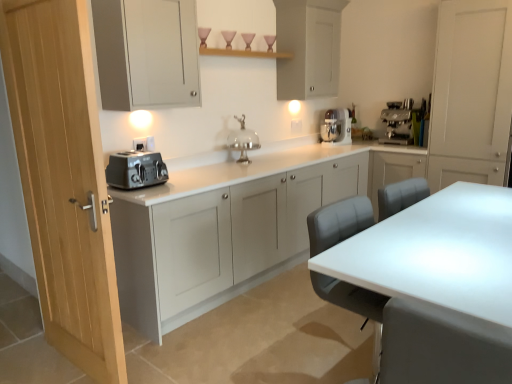
Image resolution: width=512 pixels, height=384 pixels. Find the location of `white glossy table at lower right`. white glossy table at lower right is located at coordinates (439, 285).

Describe the element at coordinates (243, 140) in the screenshot. I see `silver metallic cake stand at center` at that location.

Describe the element at coordinates (146, 53) in the screenshot. I see `matte gray cabinet at upper left, marked as the first cabinetry in a left-to-right arrangement` at that location.

Identify the location of satin silver toaster at left. (135, 170).

Describe the element at coordinates (471, 93) in the screenshot. I see `white matte cabinet at right, arranged as the fourth cabinetry when viewed from the left` at that location.

I want to click on matte white cabinet at upper center, which ranks as the second cabinetry in right-to-left order, so click(308, 47).

Who is shorter, matte white electric outlet at upper center or matte white cabinet at upper center, marked as the 3th cabinetry in a left-to-right arrangement?

Standing shorter between the two is matte white electric outlet at upper center.

Does point (139, 146) lie in front of point (315, 92)?

Yes, point (139, 146) is in front of point (315, 92).

Based on the photo, is matte white electric outlet at upper center completely or partially outside of matte white cabinet at upper center, marked as the 3th cabinetry in a left-to-right arrangement?

Yes, matte white electric outlet at upper center is located beyond the bounds of matte white cabinet at upper center, marked as the 3th cabinetry in a left-to-right arrangement.

There is a white glossy table at lower right. Where is `the 1st cabinetry above it (from a real-world perspective)`? This screenshot has height=384, width=512. the 1st cabinetry above it (from a real-world perspective) is located at coordinates (471, 93).

Is white glossy table at lower right positioned before white matte cabinet at right, arranged as the fourth cabinetry when viewed from the left?

That is True.

From the image's perspective, is white glossy table at lower right above or below white matte cabinet at right, arranged as the fourth cabinetry when viewed from the left?

From the image's perspective, white glossy table at lower right appears below white matte cabinet at right, arranged as the fourth cabinetry when viewed from the left.

Looking at this image, from a real-world perspective, relative to white matte cabinet at right, marked as the 1th cabinetry in a right-to-left arrangement, is white glossy table at lower right vertically above or below?

Clearly, from a real-world perspective, white glossy table at lower right is below white matte cabinet at right, marked as the 1th cabinetry in a right-to-left arrangement.

Is white matte cabinet at right, marked as the 1th cabinetry in a right-to-left arrangement, taller or shorter than light wood door at left?

Considering their sizes, white matte cabinet at right, marked as the 1th cabinetry in a right-to-left arrangement, has less height than light wood door at left.

Consider the image. Is white matte cabinet at right, marked as the 1th cabinetry in a right-to-left arrangement, oriented away from light wood door at left?

white matte cabinet at right, marked as the 1th cabinetry in a right-to-left arrangement, does not have its back to light wood door at left.

Which is in front, white matte cabinet at right, arranged as the fourth cabinetry when viewed from the left, or light wood door at left?

light wood door at left is more forward.

Considering the positions of point (396, 138) and point (156, 160), is point (396, 138) closer or farther from the camera than point (156, 160)?

Clearly, point (396, 138) is more distant from the camera than point (156, 160).

From the image's perspective, which one is positioned lower, satin silver coffee machine at upper right or satin silver toaster at left?

satin silver toaster at left.

Is satin silver coffee machine at upper right inside the boundaries of satin silver toaster at left, or outside?

satin silver coffee machine at upper right is outside satin silver toaster at left.

Would you consider satin silver coffee machine at upper right to be distant from satin silver toaster at left?

Indeed, satin silver coffee machine at upper right is not near satin silver toaster at left.

Can light wood door at left be found inside satin silver toaster at left?

No, light wood door at left is not inside satin silver toaster at left.

Which object is more forward, satin silver toaster at left or light wood door at left?

Positioned in front is light wood door at left.

Consider the image. Is satin silver toaster at left placed right next to light wood door at left?

They are not placed beside each other.

Is light wood door at left at the back of satin silver toaster at left?

satin silver toaster at left does not have its back to light wood door at left.

Considering the relative sizes of satin silver toaster at left and white glossy stand mixer at upper right in the image provided, is satin silver toaster at left taller than white glossy stand mixer at upper right?

In fact, satin silver toaster at left may be shorter than white glossy stand mixer at upper right.

You are a GUI agent. You are given a task and a screenshot of the screen. Output one action in this format:
    pyautogui.click(x=<x>, y=<y>)
    Task: Click on the kitchen appliance behind the satin silver toaster at left
    
    Given the screenshot: What is the action you would take?
    pyautogui.click(x=336, y=126)

Would you say satin silver toaster at left is to the left or to the right of white glossy stand mixer at upper right in the picture?

satin silver toaster at left is positioned on white glossy stand mixer at upper right's left side.

From the image's perspective, would you say satin silver toaster at left is positioned over white glossy stand mixer at upper right?

No, from the image's perspective, satin silver toaster at left is not over white glossy stand mixer at upper right.

From the image's perspective, between white glossy stand mixer at upper right and satin silver coffee machine at upper right, who is located below?

satin silver coffee machine at upper right appears lower in the image.

Based on the photo, in the image, is white glossy stand mixer at upper right positioned in front of or behind satin silver coffee machine at upper right?

white glossy stand mixer at upper right is behind satin silver coffee machine at upper right.

Looking at the image, does white glossy stand mixer at upper right seem bigger or smaller compared to satin silver coffee machine at upper right?

In the image, white glossy stand mixer at upper right appears to be smaller than satin silver coffee machine at upper right.

Is white glossy stand mixer at upper right positioned far away from satin silver coffee machine at upper right?

No.

The width and height of the screenshot is (512, 384). Find the location of `electric outlet on the left side of matte white cabinet at upper center, which ranks as the second cabinetry in right-to-left order`. electric outlet on the left side of matte white cabinet at upper center, which ranks as the second cabinetry in right-to-left order is located at coordinates (144, 144).

Locate an element on the screen. table below the white matte cabinet at right, marked as the 1th cabinetry in a right-to-left arrangement (from the image's perspective) is located at coordinates click(439, 285).

When comparing their distances from satin silver coffee machine at upper right, does white glossy table at lower right or matte gray cabinet at upper left, marked as the first cabinetry in a left-to-right arrangement, seem further?

white glossy table at lower right.

When comparing their distances from matte white electric outlet at upper center, does matte gray cabinet at left, which is the third cabinetry in right-to-left order, or light wood door at left seem closer?

light wood door at left is positioned closer to the anchor matte white electric outlet at upper center.

Based on their spatial positions, is light wood door at left or matte gray cabinet at upper left, marked as the first cabinetry in a left-to-right arrangement, further from silver metallic cake stand at center?

light wood door at left.

Based on their spatial positions, is satin silver coffee machine at upper right or white matte cabinet at right, arranged as the fourth cabinetry when viewed from the left, closer to matte gray cabinet at left, which is the third cabinetry in right-to-left order?

white matte cabinet at right, arranged as the fourth cabinetry when viewed from the left.

Considering their positions, is matte gray cabinet at left, which is the third cabinetry in right-to-left order, positioned closer to matte white cabinet at upper center, which ranks as the second cabinetry in right-to-left order, than matte gray cabinet at upper left, marked as the first cabinetry in a left-to-right arrangement?

The object closer to matte white cabinet at upper center, which ranks as the second cabinetry in right-to-left order, is matte gray cabinet at left, which is the third cabinetry in right-to-left order.

Which object lies nearer to the anchor point satin silver toaster at left, silver metallic cake stand at center or matte white electric outlet at upper center?

The object closer to satin silver toaster at left is matte white electric outlet at upper center.

Considering their positions, is silver metallic cake stand at center positioned closer to satin silver toaster at left than light wood door at left?

Among the two, light wood door at left is located nearer to satin silver toaster at left.

Estimate the real-world distances between objects in this image. Which object is further from matte white cabinet at upper center, marked as the 3th cabinetry in a left-to-right arrangement, satin silver coffee machine at upper right or matte white electric outlet at upper center?

matte white electric outlet at upper center is positioned further to the anchor matte white cabinet at upper center, marked as the 3th cabinetry in a left-to-right arrangement.

Where is `coffee machine situated between silver metallic cake stand at center and white matte cabinet at right, arranged as the fourth cabinetry when viewed from the left, from left to right`? This screenshot has height=384, width=512. coffee machine situated between silver metallic cake stand at center and white matte cabinet at right, arranged as the fourth cabinetry when viewed from the left, from left to right is located at coordinates (398, 122).

Where is `door located between white glossy table at lower right and satin silver coffee machine at upper right in the depth direction`? The width and height of the screenshot is (512, 384). door located between white glossy table at lower right and satin silver coffee machine at upper right in the depth direction is located at coordinates (63, 181).

At what (x,y) coordinates should I click in order to perform the action: click on faucet between white glossy table at lower right and white glossy stand mixer at upper right along the z-axis. Please return your answer as a coordinate pair (x, y). Looking at the image, I should click on (243, 140).

You are a GUI agent. You are given a task and a screenshot of the screen. Output one action in this format:
    pyautogui.click(x=<x>, y=<y>)
    Task: Click on the table situated between matte white electric outlet at upper center and white matte cabinet at right, marked as the 1th cabinetry in a right-to-left arrangement, from left to right
    The image size is (512, 384).
    Given the screenshot: What is the action you would take?
    pyautogui.click(x=439, y=285)